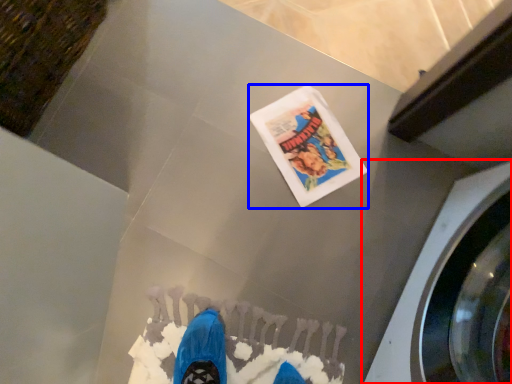
Question: Which object is closer to the camera taking this photo, washing machine (highlighted by a red box) or flyer (highlighted by a blue box)?

Choices:
 (A) washing machine
 (B) flyer

Answer: (A)